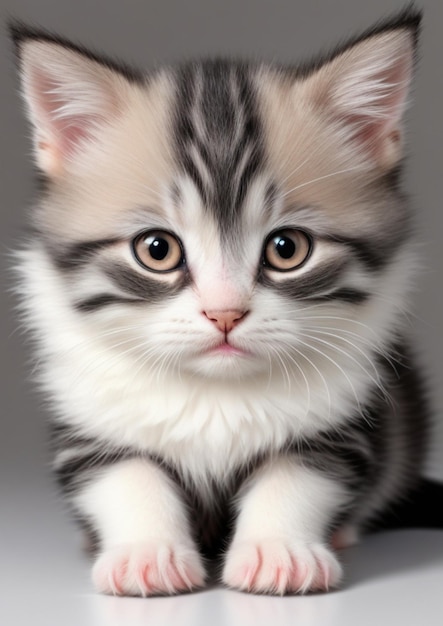
You are a GUI agent. You are given a task and a screenshot of the screen. Output one action in this format:
    pyautogui.click(x=<x>, y=<y>)
    Task: Click on the white floor
    
    Given the screenshot: What is the action you would take?
    pyautogui.click(x=147, y=618)